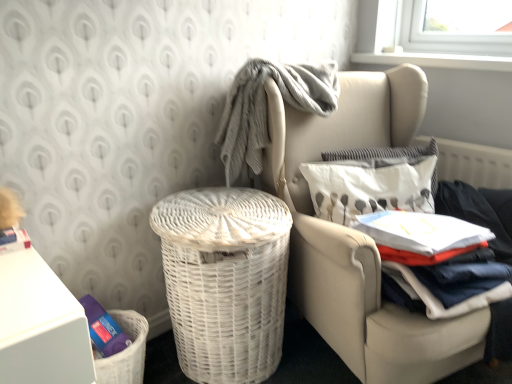
This screenshot has height=384, width=512. I want to click on white wicker basket at center-left, so click(225, 280).

What is the approximate width of white textured pillow at upper right, the 2th pillow in the back-to-front sequence?

white textured pillow at upper right, the 2th pillow in the back-to-front sequence, is 8.97 inches in width.

The width and height of the screenshot is (512, 384). In order to click on gray textured blanket at upper center in this screenshot , I will do pyautogui.click(x=267, y=108).

At what (x,y) coordinates should I click in order to perform the action: click on white wicker chair at center. Please return your answer as a coordinate pair (x, y). The height and width of the screenshot is (384, 512). Looking at the image, I should click on (360, 237).

Find the location of a particular element. white wicker basket at center-left is located at coordinates (225, 280).

Does white textured pillow at upper right, which is counted as the 1th pillow, starting from the back, come in front of white textured pillow at upper right, which is the first pillow in front-to-back order?

No, it is not.

Is white textured pillow at upper right, which is counted as the 1th pillow, starting from the back, positioned with its back to white textured pillow at upper right, which is the first pillow in front-to-back order?

No.

Is point (370, 158) closer or farther from the camera than point (329, 176)?

Clearly, point (370, 158) is more distant from the camera than point (329, 176).

From the picture: Considering the sizes of objects white textured pillow at upper right, placed as the 2th pillow when sorted from front to back, and white textured pillow at upper right, the 2th pillow in the back-to-front sequence, in the image provided, who is bigger, white textured pillow at upper right, placed as the 2th pillow when sorted from front to back, or white textured pillow at upper right, the 2th pillow in the back-to-front sequence,?

With larger size is white textured pillow at upper right, the 2th pillow in the back-to-front sequence.

Is white textured pillow at upper right, the 2th pillow in the back-to-front sequence, inside the boundaries of white wicker basket at center-left, or outside?

white textured pillow at upper right, the 2th pillow in the back-to-front sequence, is located beyond the bounds of white wicker basket at center-left.

Consider the image. Can you confirm if white textured pillow at upper right, which is the first pillow in front-to-back order, is positioned to the right of white wicker basket at center-left?

Yes, white textured pillow at upper right, which is the first pillow in front-to-back order, is to the right of white wicker basket at center-left.

Which of these two, white textured pillow at upper right, the 2th pillow in the back-to-front sequence, or white wicker basket at center-left, stands shorter?

white textured pillow at upper right, the 2th pillow in the back-to-front sequence, is shorter.

Is white cotton shirt at right behind white wicker chair at center?

Yes.

Which object is thinner, white cotton shirt at right or white wicker chair at center?

With smaller width is white cotton shirt at right.

Would you say white cotton shirt at right is a long distance from white wicker chair at center?

They are positioned close to each other.

Could you tell me if white textured pillow at upper right, which is the first pillow in front-to-back order, is facing white cotton shirt at right?

Yes, white textured pillow at upper right, which is the first pillow in front-to-back order, is oriented towards white cotton shirt at right.

Is white textured pillow at upper right, which is the first pillow in front-to-back order, spatially inside white cotton shirt at right, or outside of it?

white textured pillow at upper right, which is the first pillow in front-to-back order, is outside white cotton shirt at right.

How many degrees apart are the facing directions of white textured pillow at upper right, which is the first pillow in front-to-back order, and white cotton shirt at right?

20.6 degrees separate the facing orientations of white textured pillow at upper right, which is the first pillow in front-to-back order, and white cotton shirt at right.

Considering the sizes of objects white textured pillow at upper right, which is the first pillow in front-to-back order, and white cotton shirt at right in the image provided, who is thinner, white textured pillow at upper right, which is the first pillow in front-to-back order, or white cotton shirt at right?

white textured pillow at upper right, which is the first pillow in front-to-back order.

Is gray textured blanket at upper center in front of white wicker chair at center?

No, it is not.

Can you confirm if gray textured blanket at upper center is positioned to the right of white wicker chair at center?

In fact, gray textured blanket at upper center is to the left of white wicker chair at center.

Which of these two, gray textured blanket at upper center or white wicker chair at center, is wider?

white wicker chair at center.

Which point is more distant from viewer, [315,304] or [426,146]?

The point [426,146] is farther.

Is white textured pillow at upper right, which is counted as the 1th pillow, starting from the back, completely or partially inside white wicker chair at center?

Yes.

In the scene shown: Would you say white wicker chair at center is a long distance from white textured pillow at upper right, which is counted as the 1th pillow, starting from the back?

No.

In the image, is white cotton shirt at right positioned in front of or behind white textured pillow at upper right, which is counted as the 1th pillow, starting from the back?

In the image, white cotton shirt at right appears in front of white textured pillow at upper right, which is counted as the 1th pillow, starting from the back.

Identify the location of the 1st pillow to the left when counting from the white cotton shirt at right. The height and width of the screenshot is (384, 512). (381, 152).

Are white cotton shirt at right and white textured pillow at upper right, placed as the 2th pillow when sorted from front to back, making contact?

No, white cotton shirt at right is not making contact with white textured pillow at upper right, placed as the 2th pillow when sorted from front to back.

Which of these two, white cotton shirt at right or white textured pillow at upper right, placed as the 2th pillow when sorted from front to back, is smaller?

white textured pillow at upper right, placed as the 2th pillow when sorted from front to back, is smaller.

Find the location of a particular element. The height and width of the screenshot is (384, 512). pillow lying on the right of white textured pillow at upper right, which is the first pillow in front-to-back order is located at coordinates click(x=381, y=152).

At what (x,y) coordinates should I click in order to perform the action: click on pillow that is the 1st object located above the white wicker basket at center-left (from the image's perspective). Please return your answer as a coordinate pair (x, y). The height and width of the screenshot is (384, 512). Looking at the image, I should click on (369, 186).

Estimate the real-world distances between objects in this image. Which object is further from white cotton shirt at right, white textured pillow at upper right, the 2th pillow in the back-to-front sequence, or gray textured blanket at upper center?

Among the two, gray textured blanket at upper center is located further to white cotton shirt at right.

Which object lies nearer to the anchor point white textured pillow at upper right, the 2th pillow in the back-to-front sequence, white wicker chair at center or gray textured blanket at upper center?

The object closer to white textured pillow at upper right, the 2th pillow in the back-to-front sequence, is white wicker chair at center.

Which object lies further to the anchor point white textured pillow at upper right, placed as the 2th pillow when sorted from front to back, white wicker chair at center or gray textured blanket at upper center?

The object further to white textured pillow at upper right, placed as the 2th pillow when sorted from front to back, is white wicker chair at center.

When comparing their distances from white wicker basket at center-left, does white wicker chair at center or white cotton shirt at right seem further?

Based on the image, white cotton shirt at right appears to be further to white wicker basket at center-left.

Estimate the real-world distances between objects in this image. Which object is further from white textured pillow at upper right, placed as the 2th pillow when sorted from front to back, white wicker basket at center-left or gray textured blanket at upper center?

The object further to white textured pillow at upper right, placed as the 2th pillow when sorted from front to back, is white wicker basket at center-left.

When comparing their distances from gray textured blanket at upper center, does white wicker basket at center-left or white textured pillow at upper right, placed as the 2th pillow when sorted from front to back, seem closer?

white textured pillow at upper right, placed as the 2th pillow when sorted from front to back, is positioned closer to the anchor gray textured blanket at upper center.

Looking at the image, which one is located further to white wicker basket at center-left, white wicker chair at center or white textured pillow at upper right, placed as the 2th pillow when sorted from front to back?

white textured pillow at upper right, placed as the 2th pillow when sorted from front to back, is positioned further to the anchor white wicker basket at center-left.

Considering their positions, is gray textured blanket at upper center positioned closer to white textured pillow at upper right, which is counted as the 1th pillow, starting from the back, than white wicker basket at center-left?

gray textured blanket at upper center lies closer to white textured pillow at upper right, which is counted as the 1th pillow, starting from the back, than the other object.

Find the location of `baby clothe between white wicker chair at center and white textured pillow at upper right, which is counted as the 1th pillow, starting from the back, along the z-axis`. baby clothe between white wicker chair at center and white textured pillow at upper right, which is counted as the 1th pillow, starting from the back, along the z-axis is located at coordinates (267, 108).

At what (x,y) coordinates should I click in order to perform the action: click on pillow between white wicker basket at center-left and white textured pillow at upper right, which is counted as the 1th pillow, starting from the back, in the horizontal direction. Please return your answer as a coordinate pair (x, y). Looking at the image, I should click on (369, 186).

This screenshot has height=384, width=512. Identify the location of baby clothe located between white wicker basket at center-left and white textured pillow at upper right, which is counted as the 1th pillow, starting from the back, in the left-right direction. (267, 108).

Where is `clothing positioned between white wicker chair at center and white textured pillow at upper right, which is the first pillow in front-to-back order, from near to far`? clothing positioned between white wicker chair at center and white textured pillow at upper right, which is the first pillow in front-to-back order, from near to far is located at coordinates (459, 261).